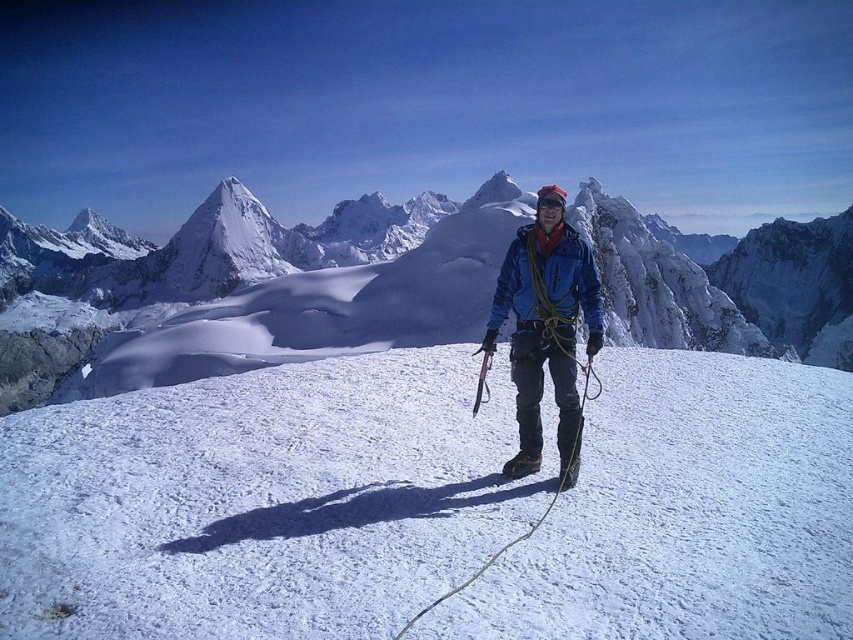
Does white snow-covered mountain at center have a larger size compared to blue fabric jacket at center?

Correct, white snow-covered mountain at center is larger in size than blue fabric jacket at center.

Can you confirm if white snow-covered mountain at center is taller than blue fabric jacket at center?

Yes, white snow-covered mountain at center is taller than blue fabric jacket at center.

Locate an element on the screen. Image resolution: width=853 pixels, height=640 pixels. white snow-covered mountain at center is located at coordinates (259, 294).

Find the location of `white snow-covered mountain at center`. white snow-covered mountain at center is located at coordinates (259, 294).

Between white frosty snow at center and blue fabric jacket at center, which one appears on the right side from the viewer's perspective?

blue fabric jacket at center is more to the right.

What do you see at coordinates (260, 500) in the screenshot?
I see `white frosty snow at center` at bounding box center [260, 500].

Find the location of a particular element. white frosty snow at center is located at coordinates [x=260, y=500].

Does white frosty snow at center appear under white snow-covered mountain at center?

Indeed, white frosty snow at center is positioned under white snow-covered mountain at center.

The width and height of the screenshot is (853, 640). What do you see at coordinates (260, 500) in the screenshot?
I see `white frosty snow at center` at bounding box center [260, 500].

Where is `white frosty snow at center`? white frosty snow at center is located at coordinates (260, 500).

The image size is (853, 640). I want to click on white frosty snow at center, so pos(260,500).